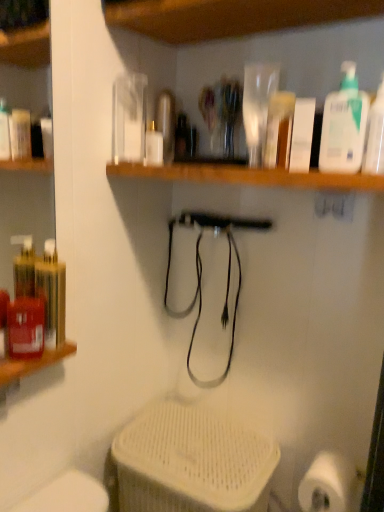
Question: Is white matte toilet paper at lower right bigger or smaller than white matte bottle at center?

Choices:
 (A) small
 (B) big

Answer: (B)

Question: Is point (334, 495) positioned closer to the camera than point (152, 136)?

Choices:
 (A) farther
 (B) closer

Answer: (B)

Question: Considering the real-world distances, which object is closest to the white plastic pump bottle at upper right, positioned as the 2th cleaning product in right-to-left order?

Choices:
 (A) translucent plastic bottle at upper right, marked as the 2th cleaning product in a left-to-right arrangement
 (B) white matte bottle at center
 (C) white matte toilet paper at lower right

Answer: (A)

Question: Which object is the farthest from the white matte toilet paper at lower right?

Choices:
 (A) white plastic pump bottle at upper right, arranged as the first cleaning product when viewed from the left
 (B) translucent plastic bottle at upper right, the first cleaning product from the right
 (C) white matte bottle at center

Answer: (C)